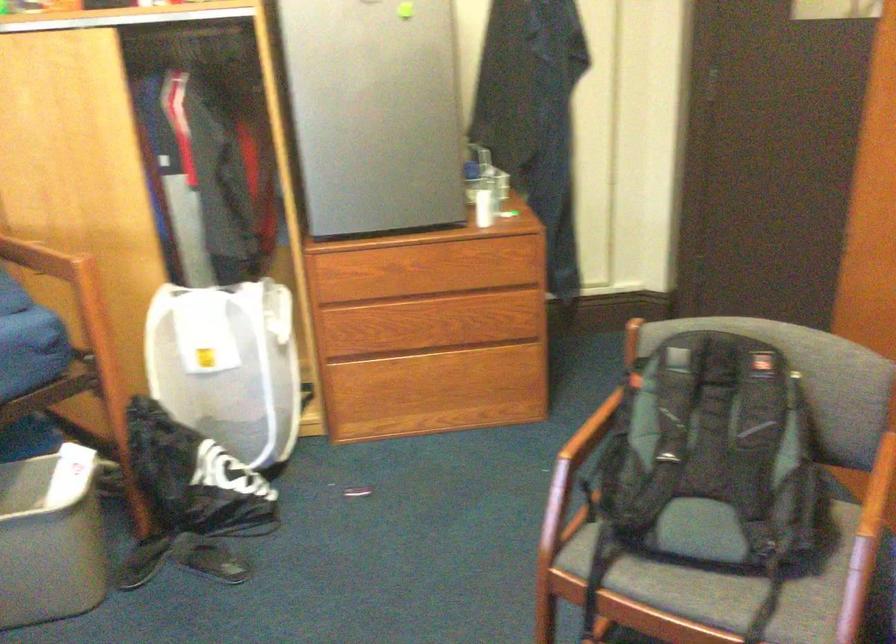
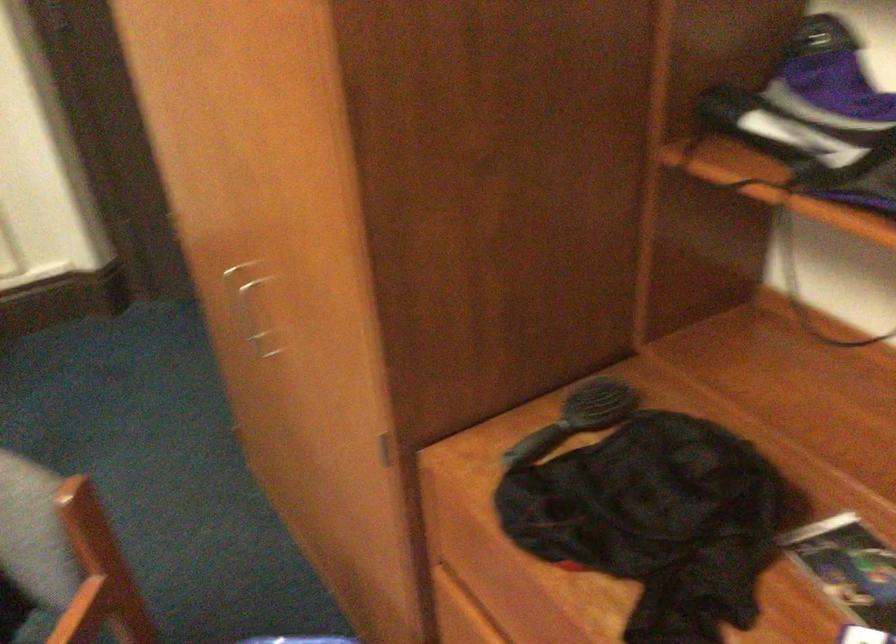
Question: How did the camera likely rotate?

Choices:
 (A) Left
 (B) Right
 (C) Up
 (D) Down

Answer: (B)